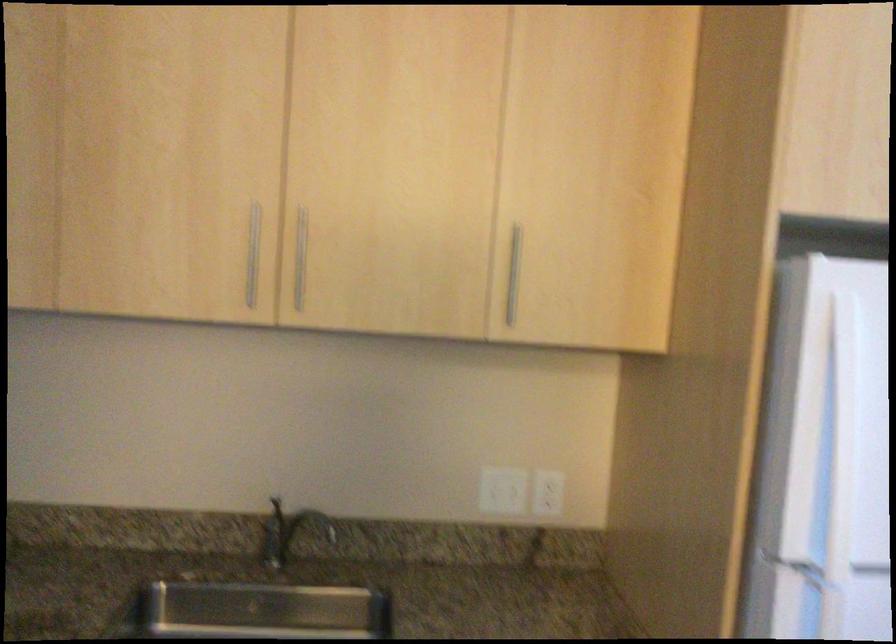
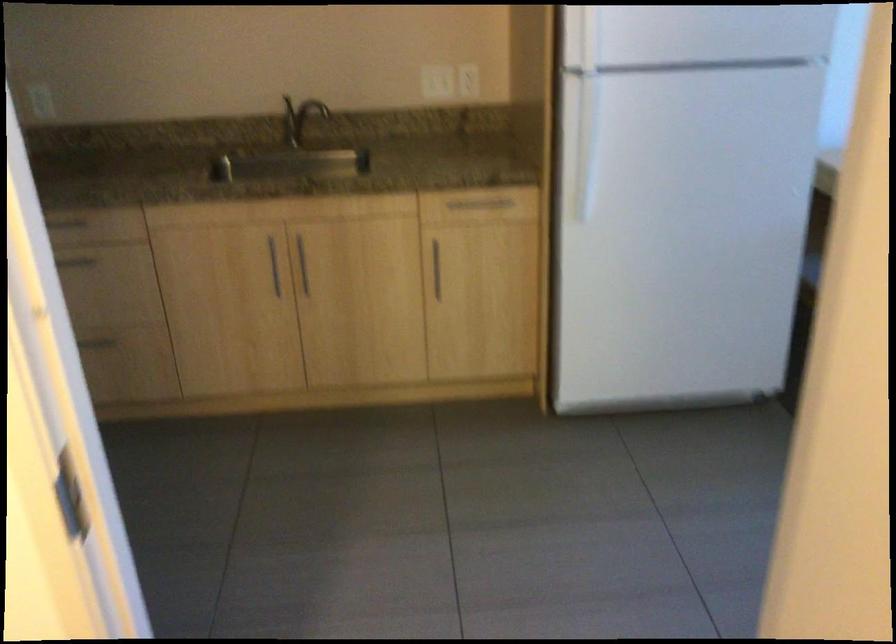
Where in the second image is the point corresponding to pixel 806 516 from the first image?

(581, 39)